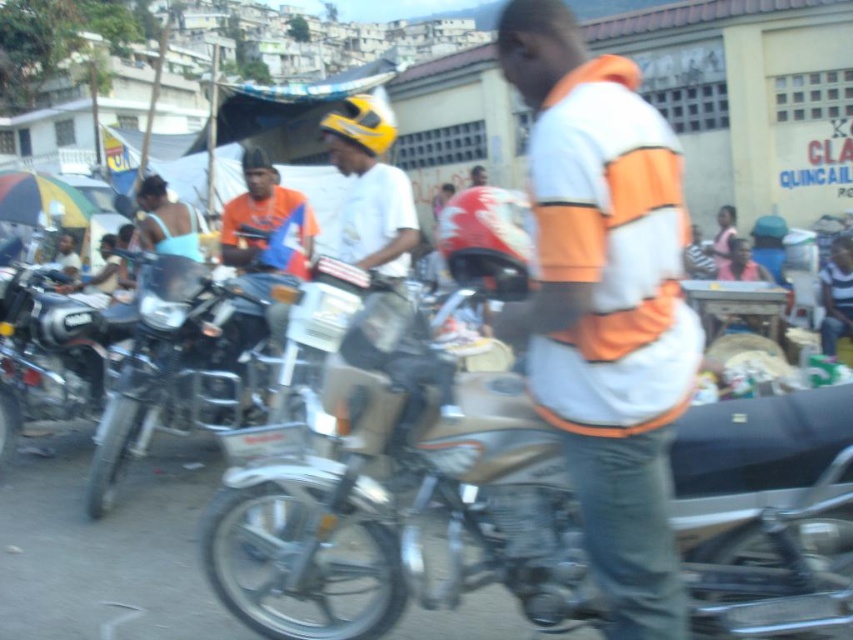
You are a photographer trying to capture the metallic silver motorcycle at left in your shot. The camera is set to focus on the point at coordinates point (183,368). Will this point be on the metallic silver motorcycle at left?

→ Yes, the point (183,368) corresponds to the metallic silver motorcycle at left, so the camera will focus on it.

You are a photographer trying to capture the shiny chrome motorcycle at left in your shot. The camera you are using has a focus point at coordinate point (48, 353). Will this point help you focus on the shiny chrome motorcycle at left?

Yes, the point (48, 353) corresponds to the shiny chrome motorcycle at left, so using this focus point will help you focus on the shiny chrome motorcycle at left.

You are a photographer standing on the street. You want to take a photo of the shiny chrome motorcycle at left without the orange fabric shirt at center appearing in the frame. Is this possible based on their positions?

The shiny chrome motorcycle at left is positioned under the orange fabric shirt at center, so the shirt would likely block the motorcycle from view unless you adjust your angle or move lower to avoid the obstruction.